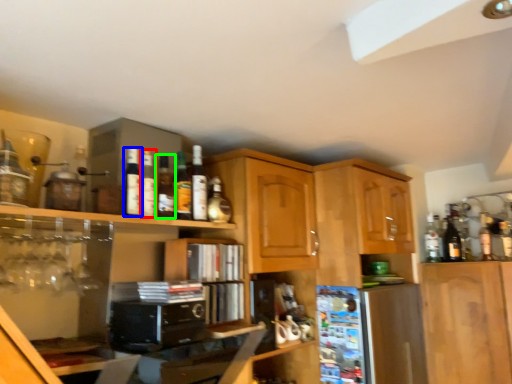
Question: Estimate the real-world distances between objects in this image. Which object is farther from bottle (highlighted by a red box), bottle (highlighted by a blue box) or bottle (highlighted by a green box)?

Choices:
 (A) bottle
 (B) bottle

Answer: (B)